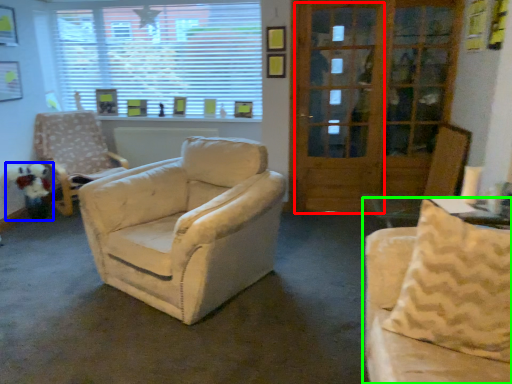
Question: Which object is the closest to the screen door (highlighted by a red box)? Choose among these: toy (highlighted by a blue box) or studio couch (highlighted by a green box).

Choices:
 (A) toy
 (B) studio couch

Answer: (B)